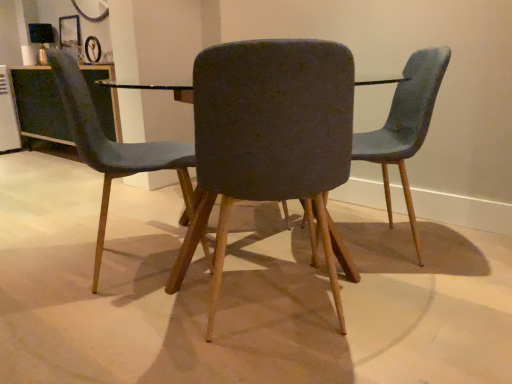
Question: From the image's perspective, does velvet blue chair at left, the 1th chair in the left-to-right sequence, appear higher than matte black table at center?

Choices:
 (A) no
 (B) yes

Answer: (B)

Question: Can you confirm if velvet blue chair at left, the 1th chair in the left-to-right sequence, is taller than matte black table at center?

Choices:
 (A) no
 (B) yes

Answer: (B)

Question: Would you say velvet blue chair at left, which appears as the third chair when viewed from the right, contains matte black table at center?

Choices:
 (A) yes
 (B) no

Answer: (B)

Question: Can you confirm if velvet blue chair at left, which appears as the third chair when viewed from the right, is thinner than matte black table at center?

Choices:
 (A) yes
 (B) no

Answer: (A)

Question: Is velvet blue chair at left, the 1th chair in the left-to-right sequence, turned away from matte black table at center?

Choices:
 (A) yes
 (B) no

Answer: (A)

Question: Considering the relative positions of velvet blue chair at left, the 1th chair in the left-to-right sequence, and matte black table at center in the image provided, is velvet blue chair at left, the 1th chair in the left-to-right sequence, to the left of matte black table at center from the viewer's perspective?

Choices:
 (A) yes
 (B) no

Answer: (A)

Question: From the image's perspective, is clear glass table at upper left located beneath textured gray chair at center, which is the second chair from right to left?

Choices:
 (A) no
 (B) yes

Answer: (A)

Question: Considering the relative sizes of clear glass table at upper left and textured gray chair at center, which is the second chair from right to left, in the image provided, is clear glass table at upper left thinner than textured gray chair at center, which is the second chair from right to left,?

Choices:
 (A) no
 (B) yes

Answer: (B)

Question: Is clear glass table at upper left bigger than textured gray chair at center, which appears as the second chair when viewed from the left?

Choices:
 (A) no
 (B) yes

Answer: (B)

Question: From a real-world perspective, is clear glass table at upper left beneath textured gray chair at center, which appears as the second chair when viewed from the left?

Choices:
 (A) no
 (B) yes

Answer: (B)

Question: Can you confirm if clear glass table at upper left is shorter than textured gray chair at center, which is the second chair from right to left?

Choices:
 (A) yes
 (B) no

Answer: (A)

Question: Does clear glass table at upper left turn towards textured gray chair at center, which appears as the second chair when viewed from the left?

Choices:
 (A) no
 (B) yes

Answer: (A)

Question: Is velvet blue chair at left, the 1th chair in the left-to-right sequence, smaller than white plastic appliance at left?

Choices:
 (A) yes
 (B) no

Answer: (B)